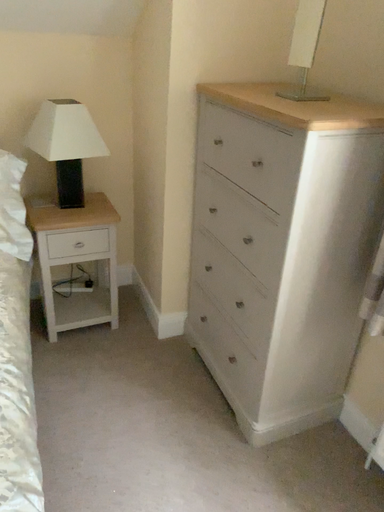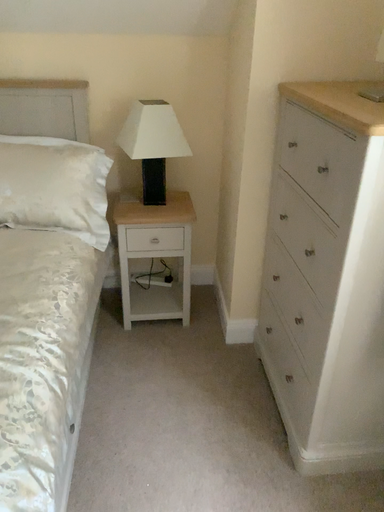
Question: Which way did the camera rotate in the video?

Choices:
 (A) rotated left
 (B) rotated right

Answer: (A)